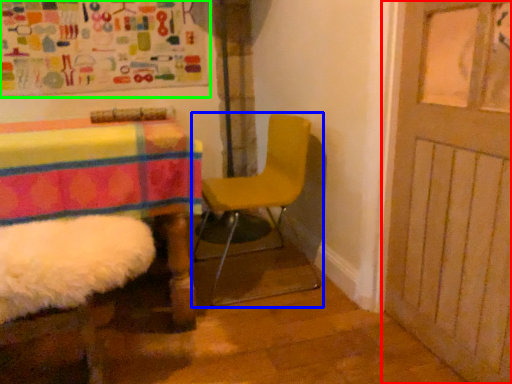
Question: Which object is the closest to the door (highlighted by a red box)? Choose among these: chair (highlighted by a blue box) or bulletin board (highlighted by a green box).

Choices:
 (A) chair
 (B) bulletin board

Answer: (A)